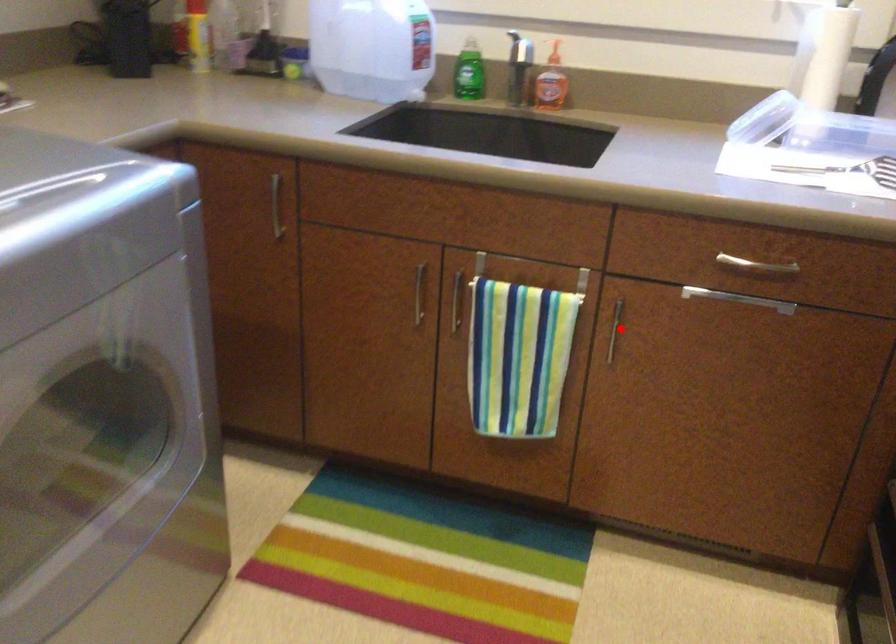
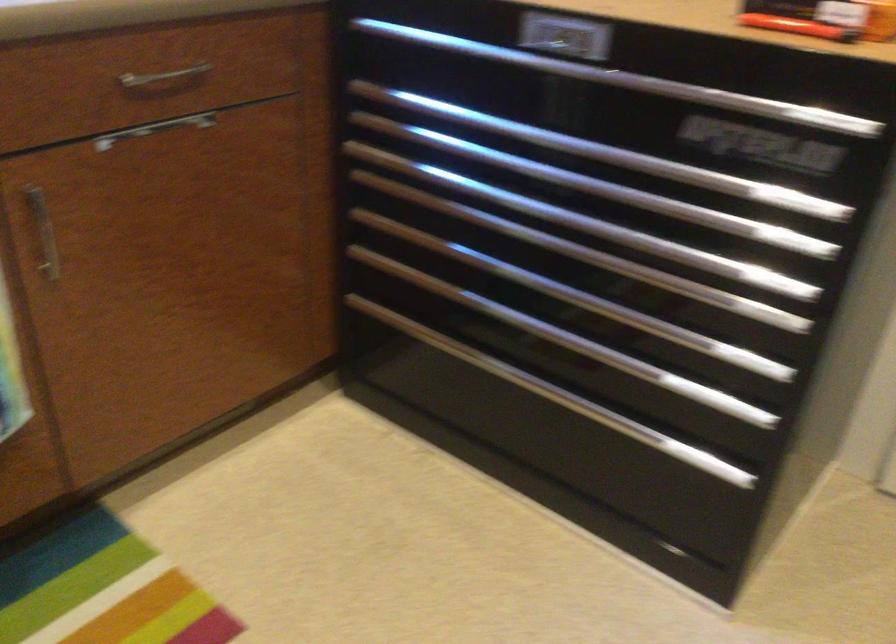
Locate, in the second image, the point that corresponds to the highlighted location in the first image.

(42, 232)